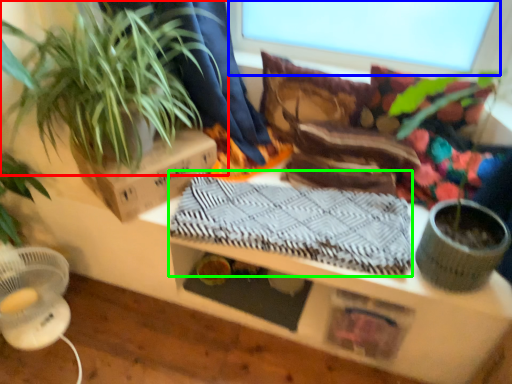
Question: Which is nearer to the houseplant (highlighted by a red box)? window screen (highlighted by a blue box) or blanket (highlighted by a green box).

Choices:
 (A) window screen
 (B) blanket

Answer: (B)